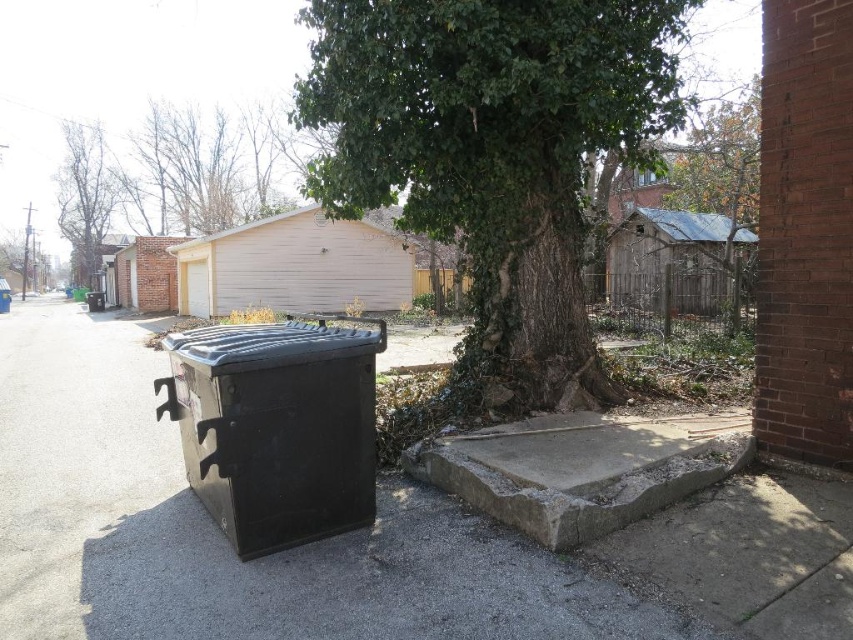
Which of these two, black plastic trash can at lower left or green leafy tree at upper center, stands shorter?

Standing shorter between the two is black plastic trash can at lower left.

Which is below, black plastic trash can at lower left or green leafy tree at upper center?

black plastic trash can at lower left is below.

I want to click on black plastic trash can at lower left, so click(x=225, y=540).

Who is more forward, (508, 602) or (720, 456)?

Point (508, 602) is more forward.

How far apart are black plastic trash can at lower left and gray concrete curb at lower center?

They are 5.93 feet apart.

Between point (409, 628) and point (717, 465), which one is positioned in front?

Point (409, 628)

This screenshot has width=853, height=640. In order to click on black plastic trash can at lower left in this screenshot , I will do `click(225, 540)`.

Image resolution: width=853 pixels, height=640 pixels. Find the location of `gray concrete curb at lower center`. gray concrete curb at lower center is located at coordinates (582, 468).

Which is above, gray concrete curb at lower center or bare branches at upper left?

bare branches at upper left is above.

Between point (688, 474) and point (68, 122), which one is positioned in front?

Point (688, 474) is more forward.

Locate an element on the screen. Image resolution: width=853 pixels, height=640 pixels. gray concrete curb at lower center is located at coordinates (582, 468).